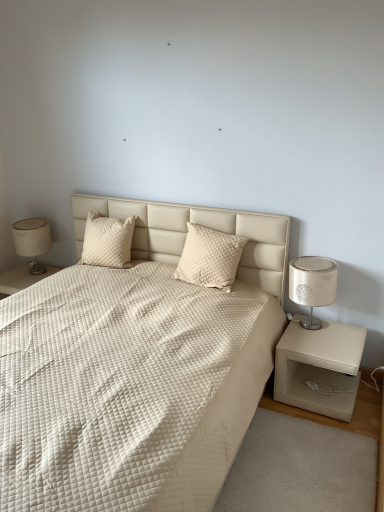
Find the location of a particular element. This screenshot has width=384, height=512. vacant space to the right of white textured lamp at right is located at coordinates (350, 330).